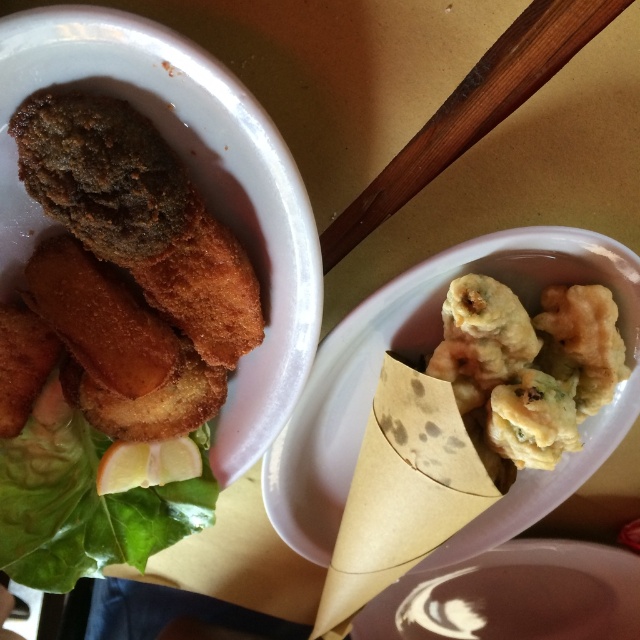
Between point (218, 326) and point (588, 337), which one is positioned in front?

Positioned in front is point (218, 326).

Who is lower down, golden crispy breaded fish fillet at left or fried golden-brown dumplings at center?

golden crispy breaded fish fillet at left is below.

Measure the distance between golden crispy breaded fish fillet at left and camera.

A distance of 27.59 inches exists between golden crispy breaded fish fillet at left and camera.

Identify the location of golden crispy breaded fish fillet at left. (113, 339).